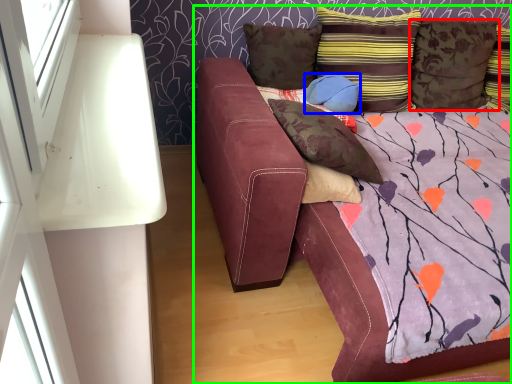
Question: Considering the real-world distances, which object is closest to pillow (highlighted by a red box)? pillow (highlighted by a blue box) or studio couch (highlighted by a green box).

Choices:
 (A) pillow
 (B) studio couch

Answer: (A)